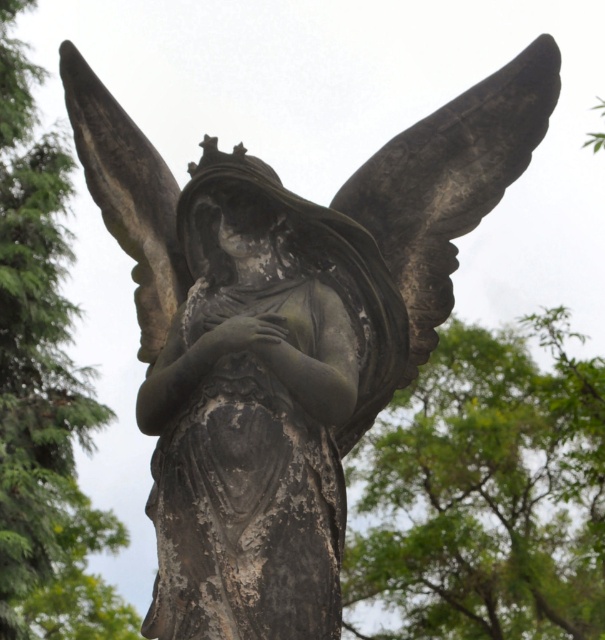
Question: Does green leafy tree at center appear on the right side of dark gray stone wing at upper right?

Choices:
 (A) no
 (B) yes

Answer: (B)

Question: In this image, where is green leafy tree at upper left located relative to dark gray stone wing at upper right?

Choices:
 (A) right
 (B) left

Answer: (B)

Question: Which point appears farthest from the camera in this image?

Choices:
 (A) (413, 340)
 (B) (7, 77)
 (C) (488, 436)

Answer: (B)

Question: Which point appears closest to the camera in this image?

Choices:
 (A) (47, 150)
 (B) (139, 356)
 (C) (401, 456)
 (D) (417, 308)

Answer: (D)

Question: Observing the image, what is the correct spatial positioning of green leafy tree at center in reference to dark gray stone wing at upper left?

Choices:
 (A) left
 (B) right

Answer: (B)

Question: Among these objects, which one is nearest to the camera?

Choices:
 (A) green leafy tree at upper left
 (B) dark gray stone wing at upper right
 (C) dark gray stone wing at upper left

Answer: (B)